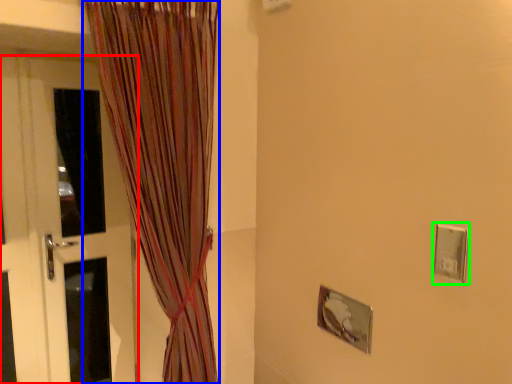
Question: Considering the real-world distances, which object is farthest from door (highlighted by a red box)? curtain (highlighted by a blue box) or electric outlet (highlighted by a green box)?

Choices:
 (A) curtain
 (B) electric outlet

Answer: (B)